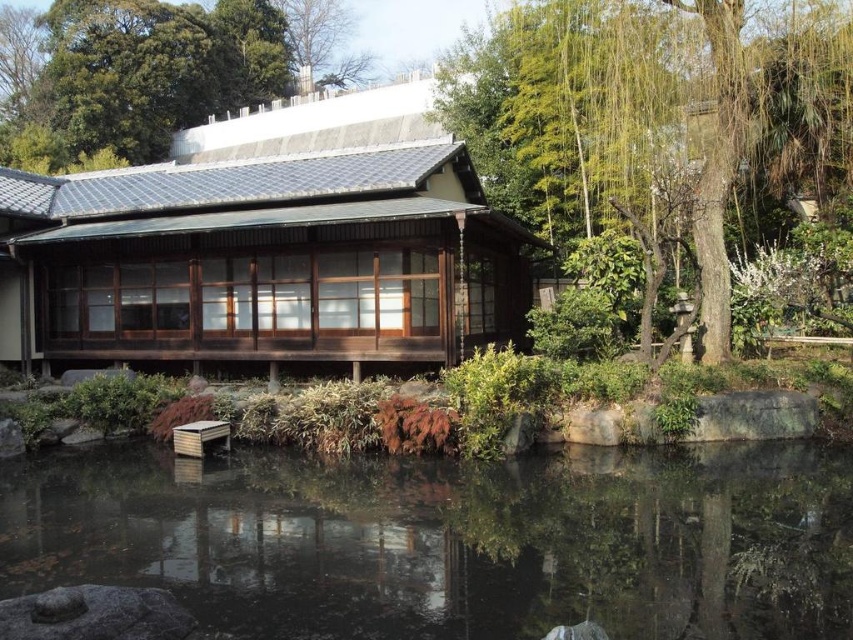
You are standing in the traditional Japanese garden and want to take a photo of the green leafy tree at right. Where should you position yourself to capture the tree in the frame?

The green leafy tree at right is located at the 2D coordinates of point 0.178 on the x axis and 0.760 on the y axis. To capture it in your photo, position yourself so that the camera is aimed towards those coordinates.

You are standing in front of the traditional Japanese garden structure. You see the transparent water at pond center and the green leafy tree at upper center. Which object is positioned to the right of the other?

The transparent water at pond center is to the right of the green leafy tree at upper center.